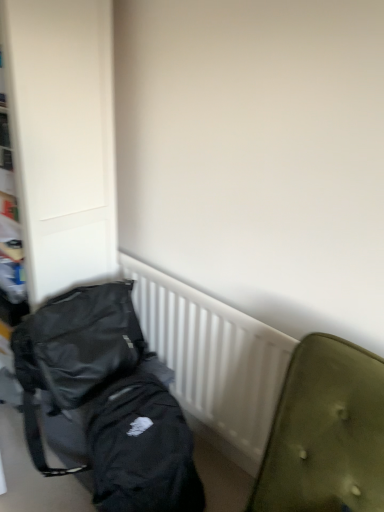
Question: From a real-world perspective, is black fabric backpack at left positioned above or below black matte backpack at lower left?

Choices:
 (A) above
 (B) below

Answer: (A)

Question: Is black fabric backpack at left to the left or to the right of black matte backpack at lower left in the image?

Choices:
 (A) left
 (B) right

Answer: (A)

Question: Based on their relative distances, which object is farther from the white plastic radiator at center?

Choices:
 (A) black fabric backpack at left
 (B) black matte backpack at lower left

Answer: (A)

Question: Considering the real-world distances, which object is closest to the black matte backpack at lower left?

Choices:
 (A) white plastic radiator at center
 (B) black fabric backpack at left

Answer: (A)